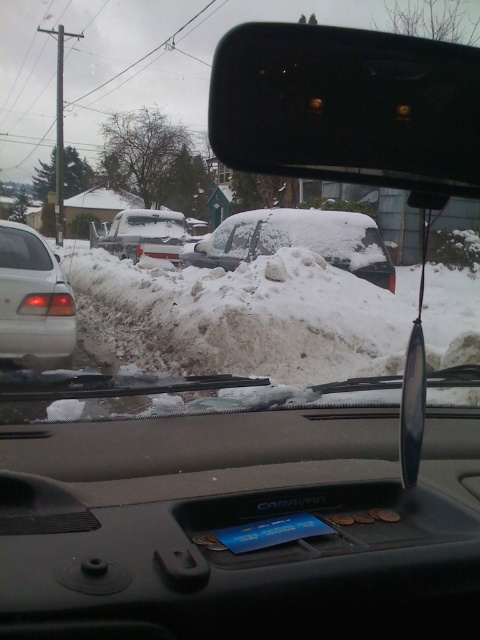
From the picture: Is snow-covered car at center bigger than black plastic mirror at center?

Yes, snow-covered car at center is bigger than black plastic mirror at center.

Who is more forward, (315, 225) or (422, 365)?

Positioned in front is point (422, 365).

Identify the location of snow-covered car at center. The width and height of the screenshot is (480, 640). (298, 241).

The height and width of the screenshot is (640, 480). What do you see at coordinates (142, 234) in the screenshot?
I see `white matte car at center` at bounding box center [142, 234].

Who is shorter, white matte car at center or black plastic mirror at center?

With less height is black plastic mirror at center.

Is point (172, 234) farther from camera compared to point (409, 360)?

Yes, point (172, 234) is behind point (409, 360).

Where is `white matte car at center`? This screenshot has width=480, height=640. white matte car at center is located at coordinates (142, 234).

Between black plastic rearview mirror at upper center and matte white car window at left, which one has less height?

With less height is matte white car window at left.

Is point (443, 93) farther from viewer compared to point (20, 237)?

No, it is not.

Between point (304, 164) and point (37, 236), which one is positioned behind?

Positioned behind is point (37, 236).

Locate an element on the screen. black plastic rearview mirror at upper center is located at coordinates (348, 108).